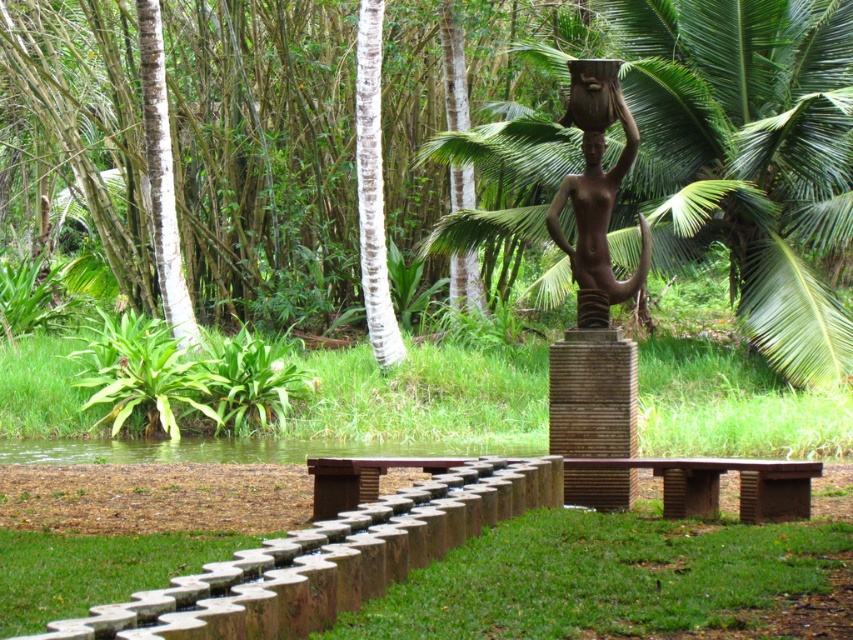
You are standing at the point labeled as point [746,157] in the image. Which direction should you walk to reach the sculpture?

The sculpture is located to the north of point [746,157]. Walk north to reach it.

You are planning to place a new statue that is 2 meters tall in the park. The statue will be placed between the green leafy palm tree at center and the brown wooden bench at center. Considering their sizes, will the statue be taller than both?

The green leafy palm tree at center has a smaller size compared to brown wooden bench at center. However, the statue is 2 meters tall. Since the bench is larger than the palm tree, but the statue height is not compared to either object in the description, we cannot determine if the statue will be taller than both based on the given information.